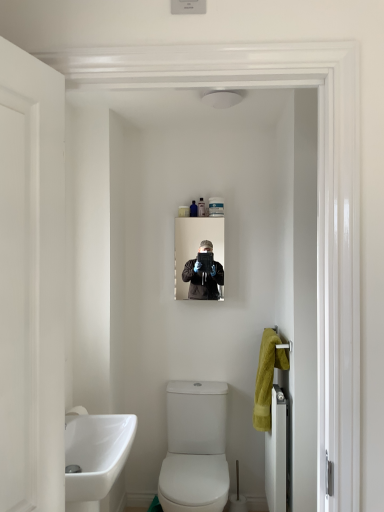
I want to click on vacant space underneath matte black mirror at center (from a real-world perspective), so click(x=203, y=381).